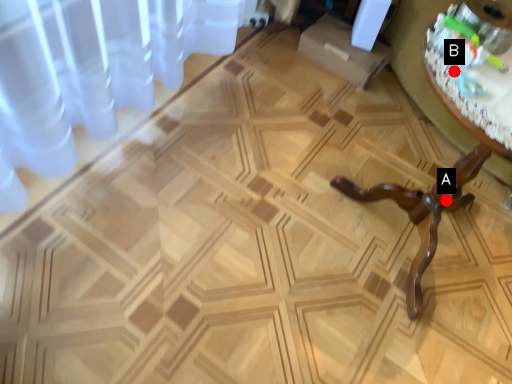
Question: Two points are circled on the image, labeled by A and B beside each circle. Among these points, which one is nearest to the camera?

Choices:
 (A) A is closer
 (B) B is closer

Answer: (B)